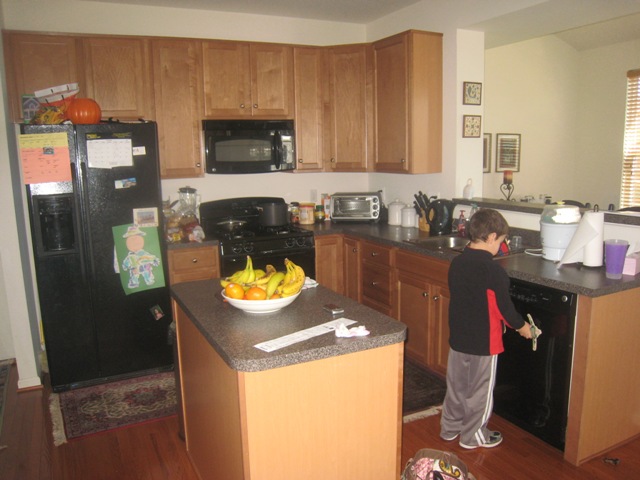
This screenshot has height=480, width=640. What are the coordinates of `floor` in the screenshot? It's located at (120, 452).